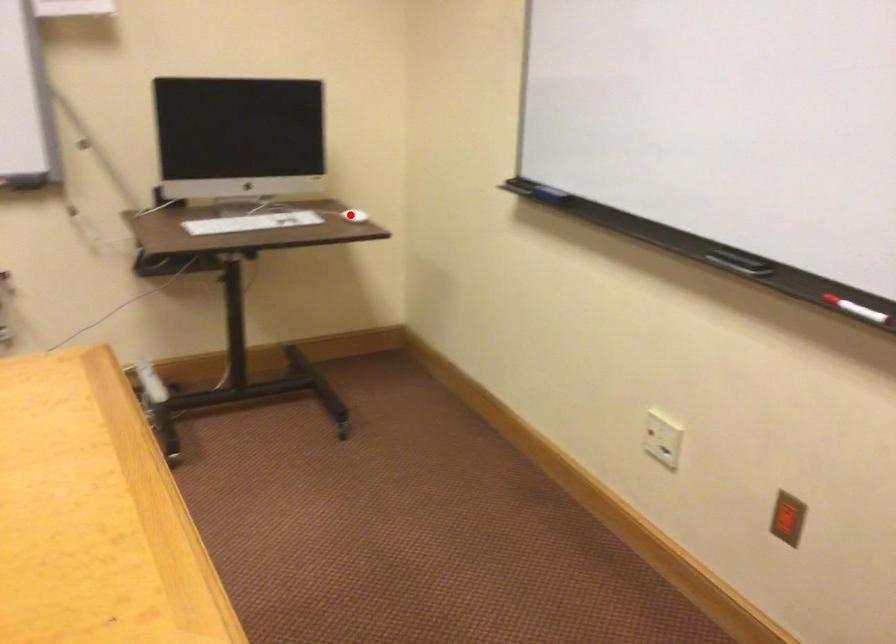
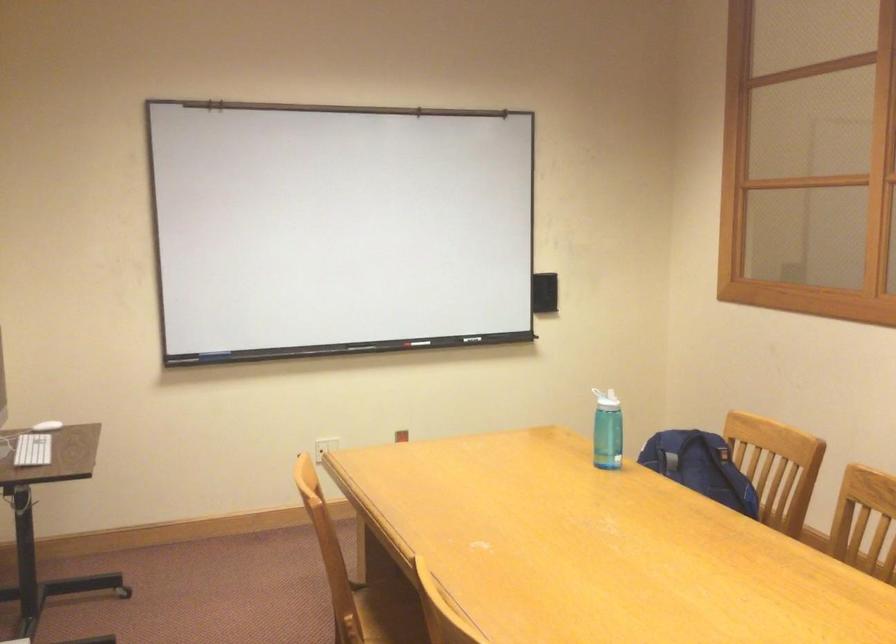
Question: A red point is marked in image1. In image2, is the corresponding 3D point closer to the camera or farther? Reply with the corresponding letter.

Choices:
 (A) The corresponding 3D point is closer.
 (B) The corresponding 3D point is farther.

Answer: (B)